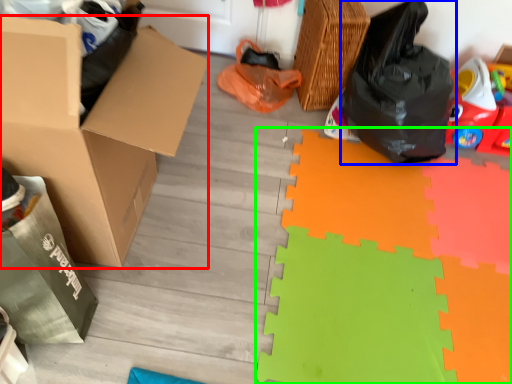
Question: Considering the real-world distances, which object is closest to box (highlighted by a red box)? plastic bag (highlighted by a blue box) or doormat (highlighted by a green box).

Choices:
 (A) plastic bag
 (B) doormat

Answer: (B)